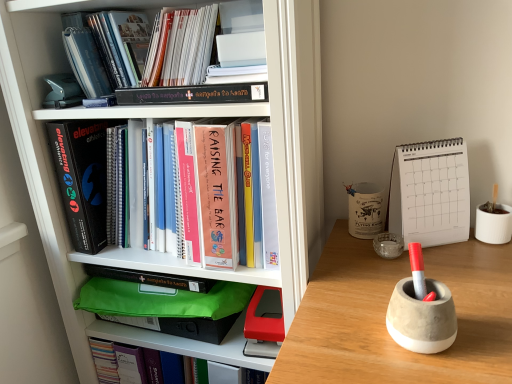
Describe the element at coordinates (366, 209) in the screenshot. The width and height of the screenshot is (512, 384). I see `white ceramic mug at right, placed as the 1th stationery when sorted from top to bottom` at that location.

Measure the distance between point (371, 229) and camera.

37.72 inches.

Where is `black matte book at left, which ranks as the first paperback book in left-to-right order`? The height and width of the screenshot is (384, 512). black matte book at left, which ranks as the first paperback book in left-to-right order is located at coordinates (82, 178).

What is the approximate width of matte paper folder at upper center, arranged as the 4th book when ordered from the bottom?

matte paper folder at upper center, arranged as the 4th book when ordered from the bottom, is 10.02 inches in width.

Locate an element on the screen. white matte bookcase at left is located at coordinates (296, 138).

Is point (445, 296) farther from camera compared to point (288, 88)?

No, (445, 296) is closer to viewer.

Are concrete pen holder at right, the third stationery positioned from the back, and white matte bookcase at left making contact?

concrete pen holder at right, the third stationery positioned from the back, is not next to white matte bookcase at left, and they're not touching.

Is concrete pen holder at right, the 3th stationery viewed from the top, to the left or to the right of white matte bookcase at left in the image?

Based on their positions, concrete pen holder at right, the 3th stationery viewed from the top, is located to the right of white matte bookcase at left.

How far apart are concrete pen holder at right, the third stationery positioned from the back, and white matte bookcase at left?

19.24 inches.

From the image's perspective, does concrete pen holder at right, which is the first stationery from bottom to top, appear lower than matte paper folder at upper center, placed as the first book when sorted from top to bottom?

Indeed, from the image's perspective, concrete pen holder at right, which is the first stationery from bottom to top, is shown beneath matte paper folder at upper center, placed as the first book when sorted from top to bottom.

Who is shorter, concrete pen holder at right, which is the first stationery from bottom to top, or matte paper folder at upper center, placed as the first book when sorted from top to bottom?

With less height is concrete pen holder at right, which is the first stationery from bottom to top.

Can you tell me how much concrete pen holder at right, the 1th stationery viewed from the front, and matte paper folder at upper center, placed as the first book when sorted from top to bottom, differ in facing direction?

The facing directions of concrete pen holder at right, the 1th stationery viewed from the front, and matte paper folder at upper center, placed as the first book when sorted from top to bottom, are 4.02 degrees apart.

From a real-world perspective, is concrete pen holder at right, which is the first stationery from bottom to top, above or below matte paper folder at upper center, placed as the first book when sorted from top to bottom?

From a real-world perspective, concrete pen holder at right, which is the first stationery from bottom to top, is physically below matte paper folder at upper center, placed as the first book when sorted from top to bottom.

Looking at this image, is black matte book at left, the second paperback book positioned from the right, not near white matte bookcase at left?

No, black matte book at left, the second paperback book positioned from the right, is not far away from white matte bookcase at left.

Considering the relative positions of black matte book at left, the second paperback book positioned from the right, and white matte bookcase at left in the image provided, is black matte book at left, the second paperback book positioned from the right, to the left or to the right of white matte bookcase at left?

Based on their positions, black matte book at left, the second paperback book positioned from the right, is located to the left of white matte bookcase at left.

The image size is (512, 384). Identify the location of bookcase below the black matte book at left, which ranks as the first paperback book in left-to-right order (from a real-world perspective). (296, 138).

Between point (81, 236) and point (106, 253), which one is positioned behind?

Point (106, 253)

The image size is (512, 384). Find the location of `paperback book on the right of matte paper folder at upper center, placed as the first book when sorted from top to bottom`. paperback book on the right of matte paper folder at upper center, placed as the first book when sorted from top to bottom is located at coordinates (430, 193).

Considering the relative sizes of white paper calendar at upper right, which is the 1th paperback book in right-to-left order, and matte paper folder at upper center, arranged as the 4th book when ordered from the bottom, in the image provided, is white paper calendar at upper right, which is the 1th paperback book in right-to-left order, smaller than matte paper folder at upper center, arranged as the 4th book when ordered from the bottom,?

Yes, white paper calendar at upper right, which is the 1th paperback book in right-to-left order, is smaller than matte paper folder at upper center, arranged as the 4th book when ordered from the bottom.

How many degrees apart are the facing directions of white paper calendar at upper right, which is the 1th paperback book in right-to-left order, and matte paper folder at upper center, placed as the first book when sorted from top to bottom?

There is a 28.5-degree angle between the facing directions of white paper calendar at upper right, which is the 1th paperback book in right-to-left order, and matte paper folder at upper center, placed as the first book when sorted from top to bottom.

Looking at this image, considering the sizes of objects white paper calendar at upper right, which is the 1th paperback book in right-to-left order, and matte paper folder at upper center, arranged as the 4th book when ordered from the bottom, in the image provided, who is thinner, white paper calendar at upper right, which is the 1th paperback book in right-to-left order, or matte paper folder at upper center, arranged as the 4th book when ordered from the bottom,?

Thinner between the two is white paper calendar at upper right, which is the 1th paperback book in right-to-left order.

Considering the sizes of objects black matte book at left, the second paperback book positioned from the right, and white paper calendar at upper right, which is the 1th paperback book in right-to-left order, in the image provided, who is wider, black matte book at left, the second paperback book positioned from the right, or white paper calendar at upper right, which is the 1th paperback book in right-to-left order,?

Wider between the two is black matte book at left, the second paperback book positioned from the right.

In the scene shown: Between black matte book at left, the second paperback book positioned from the right, and white paper calendar at upper right, which is the 1th paperback book in right-to-left order, which one has more height?

With more height is black matte book at left, the second paperback book positioned from the right.

Where is `paperback book on the right of the black matte book at left, the second paperback book positioned from the right`? The height and width of the screenshot is (384, 512). paperback book on the right of the black matte book at left, the second paperback book positioned from the right is located at coordinates (430, 193).

From the image's perspective, which object appears higher, black matte book at left, which ranks as the first paperback book in left-to-right order, or white paper calendar at upper right, which is the 1th paperback book in right-to-left order?

black matte book at left, which ranks as the first paperback book in left-to-right order, is shown above in the image.

Is white ceramic mug at right, which is counted as the 3th stationery, starting from the front, smaller than hardcover book at upper left, which appears as the second book when viewed from the top?

Indeed, white ceramic mug at right, which is counted as the 3th stationery, starting from the front, has a smaller size compared to hardcover book at upper left, which appears as the second book when viewed from the top.

From a real-world perspective, between white ceramic mug at right, which is counted as the 3th stationery, starting from the front, and hardcover book at upper left, placed as the 3th book when sorted from bottom to top, who is vertically higher?

hardcover book at upper left, placed as the 3th book when sorted from bottom to top.

Considering the relative sizes of white ceramic mug at right, positioned as the first stationery in back-to-front order, and hardcover book at upper left, placed as the 3th book when sorted from bottom to top, in the image provided, is white ceramic mug at right, positioned as the first stationery in back-to-front order, wider than hardcover book at upper left, placed as the 3th book when sorted from bottom to top,?

In fact, white ceramic mug at right, positioned as the first stationery in back-to-front order, might be narrower than hardcover book at upper left, placed as the 3th book when sorted from bottom to top.

Is white ceramic mug at right, placed as the 1th stationery when sorted from top to bottom, turned away from hardcover book at upper left, placed as the 3th book when sorted from bottom to top?

No, hardcover book at upper left, placed as the 3th book when sorted from bottom to top, is not at the back of white ceramic mug at right, placed as the 1th stationery when sorted from top to bottom.

From the image's perspective, is green matte folder at center, which ranks as the fourth book in top-to-bottom order, located above black matte book at left, which ranks as the first paperback book in left-to-right order?

Actually, green matte folder at center, which ranks as the fourth book in top-to-bottom order, appears below black matte book at left, which ranks as the first paperback book in left-to-right order, in the image.

Is green matte folder at center, positioned as the first book in bottom-to-top order, at the left side of black matte book at left, which ranks as the first paperback book in left-to-right order?

Incorrect, green matte folder at center, positioned as the first book in bottom-to-top order, is not on the left side of black matte book at left, which ranks as the first paperback book in left-to-right order.

Is green matte folder at center, which ranks as the fourth book in top-to-bottom order, oriented away from black matte book at left, which ranks as the first paperback book in left-to-right order?

No, green matte folder at center, which ranks as the fourth book in top-to-bottom order,'s orientation is not away from black matte book at left, which ranks as the first paperback book in left-to-right order.

Locate an element on the screen. paperback book on the left of green matte folder at center, which ranks as the fourth book in top-to-bottom order is located at coordinates (82, 178).

Image resolution: width=512 pixels, height=384 pixels. There is a white matte bookcase at left. In order to click on the 2nd stationery above it (from a real-world perspective) in this screenshot , I will do `click(422, 317)`.

Identify the location of the 2nd stationery directly beneath the matte paper folder at upper center, placed as the first book when sorted from top to bottom (from a real-world perspective). (422, 317).

Based on their spatial positions, is concrete pen holder at right, the 1th stationery viewed from the front, or clear glass ashtray at center-right, which is the 2th stationery from front to back, further from hardcover book at upper left, which appears as the second book when viewed from the top?

concrete pen holder at right, the 1th stationery viewed from the front, lies further to hardcover book at upper left, which appears as the second book when viewed from the top, than the other object.

From the image, which object appears to be nearer to concrete pen holder at right, the third stationery positioned from the back, black matte book at left, the second paperback book positioned from the right, or white matte bookcase at left?

The object closer to concrete pen holder at right, the third stationery positioned from the back, is white matte bookcase at left.

From the image, which object appears to be nearer to green matte folder at center, positioned as the first book in bottom-to-top order, white ceramic mug at right, placed as the 1th stationery when sorted from top to bottom, or white paper calendar at upper right, which ranks as the 2th paperback book in left-to-right order?

The object closer to green matte folder at center, positioned as the first book in bottom-to-top order, is white ceramic mug at right, placed as the 1th stationery when sorted from top to bottom.

Estimate the real-world distances between objects in this image. Which object is further from hardcover book at upper left, placed as the 3th book when sorted from bottom to top, clear glass ashtray at center-right, which is the 2th stationery in top-to-bottom order, or white matte bookcase at left?

clear glass ashtray at center-right, which is the 2th stationery in top-to-bottom order, is further to hardcover book at upper left, placed as the 3th book when sorted from bottom to top.

Considering their positions, is white paper calendar at upper right, which ranks as the 2th paperback book in left-to-right order, positioned further to black matte book at left, the second paperback book positioned from the right, than concrete pen holder at right, which is the first stationery from bottom to top?

concrete pen holder at right, which is the first stationery from bottom to top.

Which object lies nearer to the anchor point hardcover book at upper center, which ranks as the 3th book in top-to-bottom order, clear glass ashtray at center-right, which is the 2th stationery in top-to-bottom order, or black matte book at left, which ranks as the first paperback book in left-to-right order?

The object closer to hardcover book at upper center, which ranks as the 3th book in top-to-bottom order, is black matte book at left, which ranks as the first paperback book in left-to-right order.

Which object lies further to the anchor point clear glass ashtray at center-right, which is the 2th stationery from front to back, white ceramic mug at right, which is counted as the 3th stationery, starting from the front, or white paper calendar at upper right, which ranks as the 2th paperback book in left-to-right order?

white paper calendar at upper right, which ranks as the 2th paperback book in left-to-right order, is positioned further to the anchor clear glass ashtray at center-right, which is the 2th stationery from front to back.

Estimate the real-world distances between objects in this image. Which object is further from white ceramic mug at right, which is counted as the 3th stationery, starting from the front, white paper calendar at upper right, which is the 1th paperback book in right-to-left order, or green matte folder at center, which ranks as the fourth book in top-to-bottom order?

green matte folder at center, which ranks as the fourth book in top-to-bottom order.

Where is `book between matte paper folder at upper center, arranged as the 4th book when ordered from the bottom, and black matte book at left, the second paperback book positioned from the right, in the vertical direction`? This screenshot has width=512, height=384. book between matte paper folder at upper center, arranged as the 4th book when ordered from the bottom, and black matte book at left, the second paperback book positioned from the right, in the vertical direction is located at coordinates (105, 49).

The image size is (512, 384). In order to click on bookcase between black matte book at left, the second paperback book positioned from the right, and white paper calendar at upper right, which is the 1th paperback book in right-to-left order in this screenshot , I will do `click(296, 138)`.

The height and width of the screenshot is (384, 512). In order to click on bookcase between matte paper folder at upper center, arranged as the 4th book when ordered from the bottom, and concrete pen holder at right, which is the first stationery from bottom to top, vertically in this screenshot , I will do `click(296, 138)`.

Image resolution: width=512 pixels, height=384 pixels. I want to click on book between hardcover book at upper left, placed as the 3th book when sorted from bottom to top, and green matte folder at center, which ranks as the fourth book in top-to-bottom order, in the up-down direction, so click(134, 226).